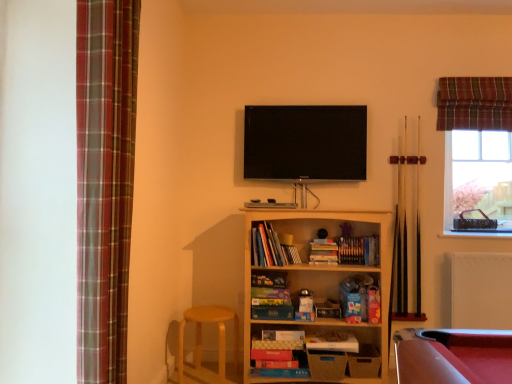
Question: Is plaid fabric curtain at upper right, which is the 1th curtain from right to left, outside brown wooden pool cue at right, arranged as the second cue when viewed from the right?

Choices:
 (A) yes
 (B) no

Answer: (A)

Question: Is plaid fabric curtain at upper right, marked as the second curtain in a front-to-back arrangement, at the left side of brown wooden pool cue at right, arranged as the second cue when viewed from the right?

Choices:
 (A) yes
 (B) no

Answer: (B)

Question: Is plaid fabric curtain at upper right, the 2th curtain in the left-to-right sequence, shorter than brown wooden pool cue at right, arranged as the second cue when viewed from the right?

Choices:
 (A) no
 (B) yes

Answer: (B)

Question: Is plaid fabric curtain at upper right, marked as the second curtain in a front-to-back arrangement, not close to brown wooden pool cue at right, marked as the first cue in a left-to-right arrangement?

Choices:
 (A) yes
 (B) no

Answer: (B)

Question: Considering the relative sizes of plaid fabric curtain at upper right, marked as the second curtain in a front-to-back arrangement, and brown wooden pool cue at right, marked as the first cue in a left-to-right arrangement, in the image provided, is plaid fabric curtain at upper right, marked as the second curtain in a front-to-back arrangement, wider than brown wooden pool cue at right, marked as the first cue in a left-to-right arrangement,?

Choices:
 (A) no
 (B) yes

Answer: (B)

Question: Relative to clear glass window at upper right, is flat screen tv at upper center in front or behind?

Choices:
 (A) behind
 (B) front

Answer: (B)

Question: In terms of height, does flat screen tv at upper center look taller or shorter compared to clear glass window at upper right?

Choices:
 (A) short
 (B) tall

Answer: (A)

Question: From the image's perspective, is flat screen tv at upper center above or below clear glass window at upper right?

Choices:
 (A) below
 (B) above

Answer: (B)

Question: Is flat screen tv at upper center wider or thinner than clear glass window at upper right?

Choices:
 (A) wide
 (B) thin

Answer: (B)

Question: From a real-world perspective, is white matte radiator at lower right positioned above or below wooden bookshelf at center?

Choices:
 (A) above
 (B) below

Answer: (B)

Question: In the image, is white matte radiator at lower right on the left side or the right side of wooden bookshelf at center?

Choices:
 (A) right
 (B) left

Answer: (A)

Question: Which is correct: white matte radiator at lower right is inside wooden bookshelf at center, or outside of it?

Choices:
 (A) inside
 (B) outside

Answer: (B)

Question: Relative to wooden bookshelf at center, is white matte radiator at lower right in front or behind?

Choices:
 (A) front
 (B) behind

Answer: (B)

Question: From a real-world perspective, is wooden pool cue at right, which is counted as the 2th cue, starting from the left, positioned above or below brown wooden pool cue at right, marked as the first cue in a left-to-right arrangement?

Choices:
 (A) above
 (B) below

Answer: (B)

Question: Is wooden pool cue at right, which is counted as the 2th cue, starting from the left, taller or shorter than brown wooden pool cue at right, marked as the first cue in a left-to-right arrangement?

Choices:
 (A) short
 (B) tall

Answer: (B)